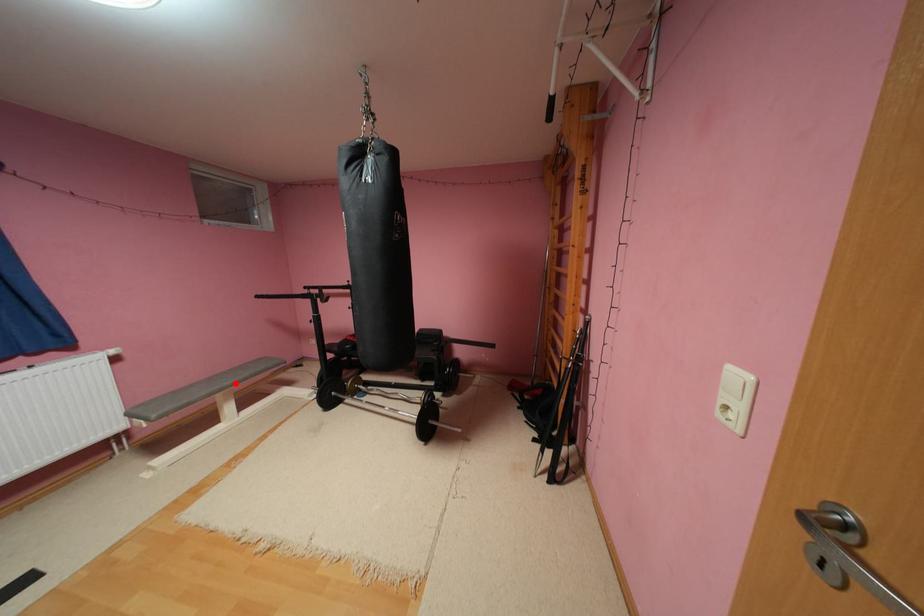
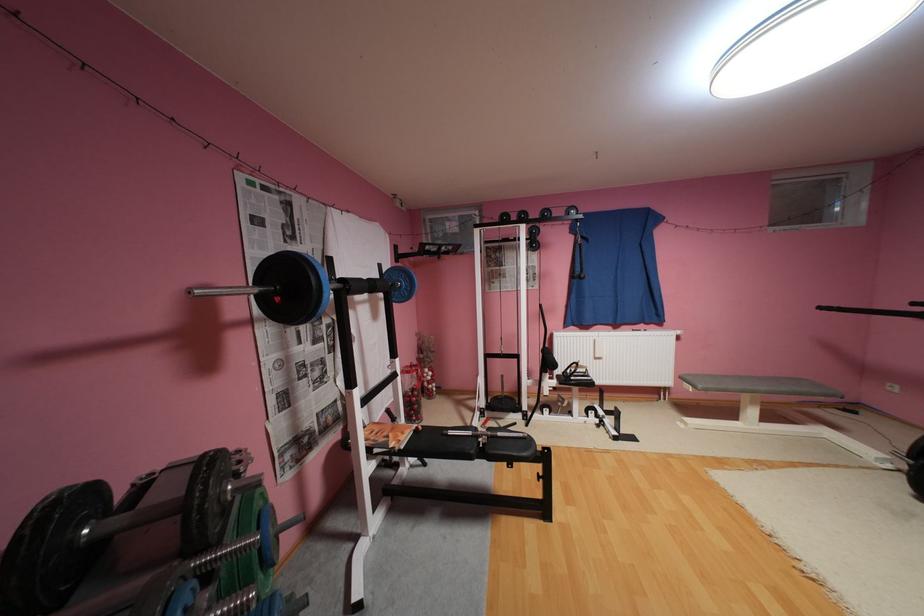
Locate, in the second image, the point that corresponds to the highlighted location in the first image.

(771, 387)